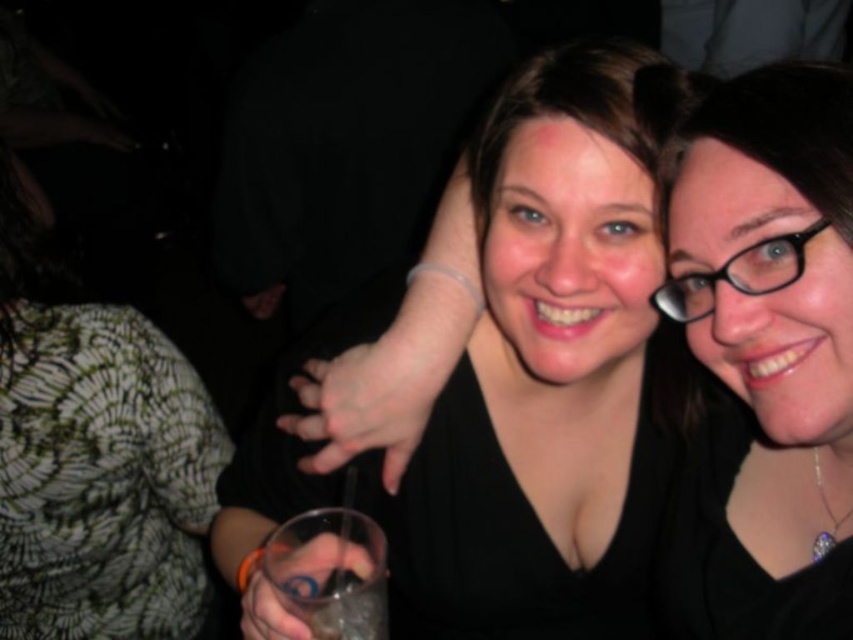
Question: Which point is farther to the camera?

Choices:
 (A) green textured shirt at left
 (B) black matte/black shirt at center
 (C) clear plastic cup at center
 (D) black plastic glasses at upper right

Answer: (A)

Question: Is green textured shirt at left thinner than clear plastic cup at center?

Choices:
 (A) yes
 (B) no

Answer: (B)

Question: Which is nearer to the clear plastic cup at center?

Choices:
 (A) black plastic glasses at upper right
 (B) green textured shirt at left

Answer: (A)

Question: Can you confirm if black matte/black shirt at center is thinner than black plastic glasses at upper right?

Choices:
 (A) no
 (B) yes

Answer: (A)

Question: Which of the following is the farthest from the observer?

Choices:
 (A) (347, 538)
 (B) (752, 136)
 (C) (706, 310)

Answer: (A)

Question: Is green textured shirt at left positioned before black plastic glasses at upper right?

Choices:
 (A) yes
 (B) no

Answer: (B)